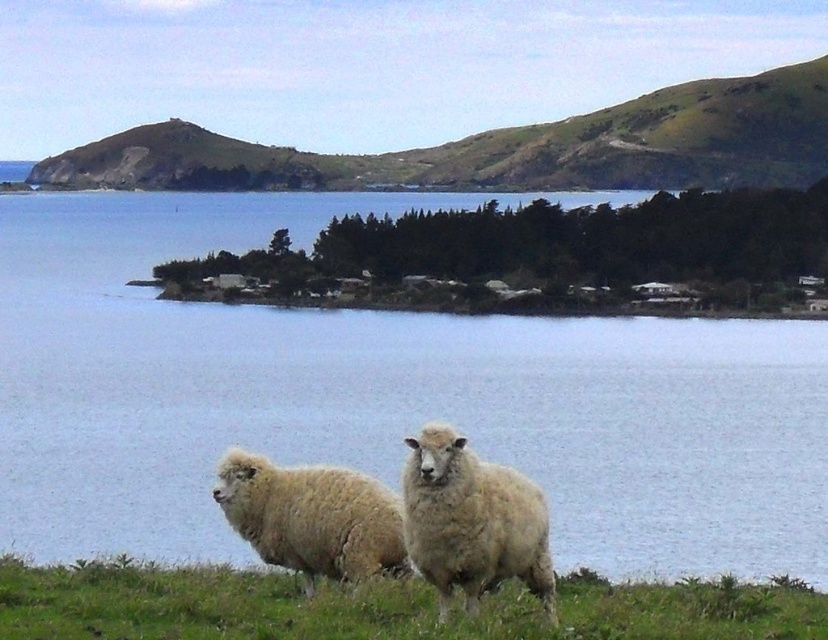
Does blue water at center appear on the right side of white woolly sheep at center?

In fact, blue water at center is to the left of white woolly sheep at center.

Is point (243, 413) positioned before point (465, 588)?

No, it is not.

This screenshot has height=640, width=828. What are the coordinates of `blue water at center` in the screenshot? It's located at click(383, 396).

Is blue water at center further to the viewer compared to green grassy hillside at upper center?

No, blue water at center is closer to the viewer.

Based on the photo, who is taller, blue water at center or green grassy hillside at upper center?

Standing taller between the two is blue water at center.

The height and width of the screenshot is (640, 828). Identify the location of blue water at center. (383, 396).

Does white fluffy grass at center have a greater height compared to fuzzy white sheep at lower center?

No.

Which is below, white fluffy grass at center or fuzzy white sheep at lower center?

white fluffy grass at center is lower down.

From the picture: Who is more forward, (632, 611) or (248, 520)?

Point (632, 611) is in front.

I want to click on white fluffy grass at center, so click(x=379, y=605).